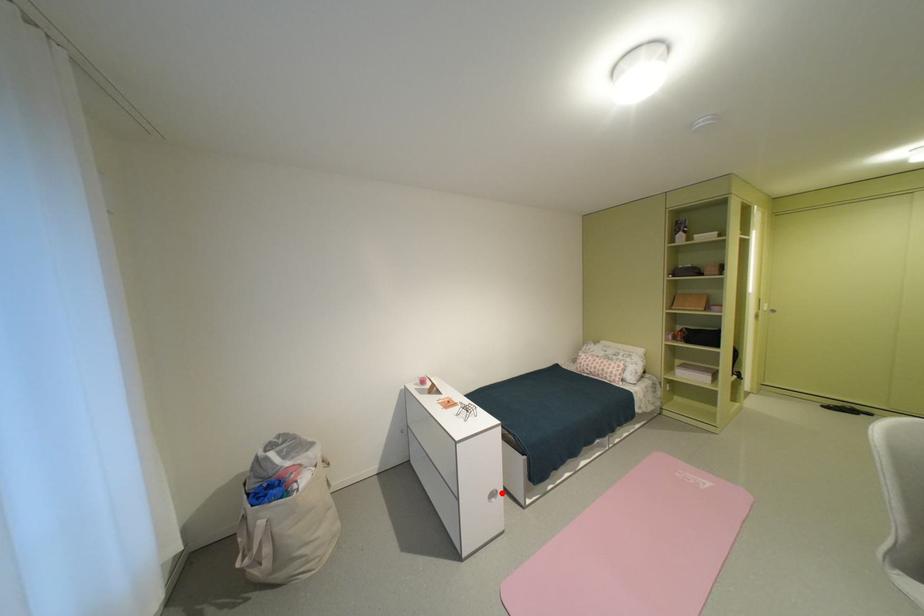
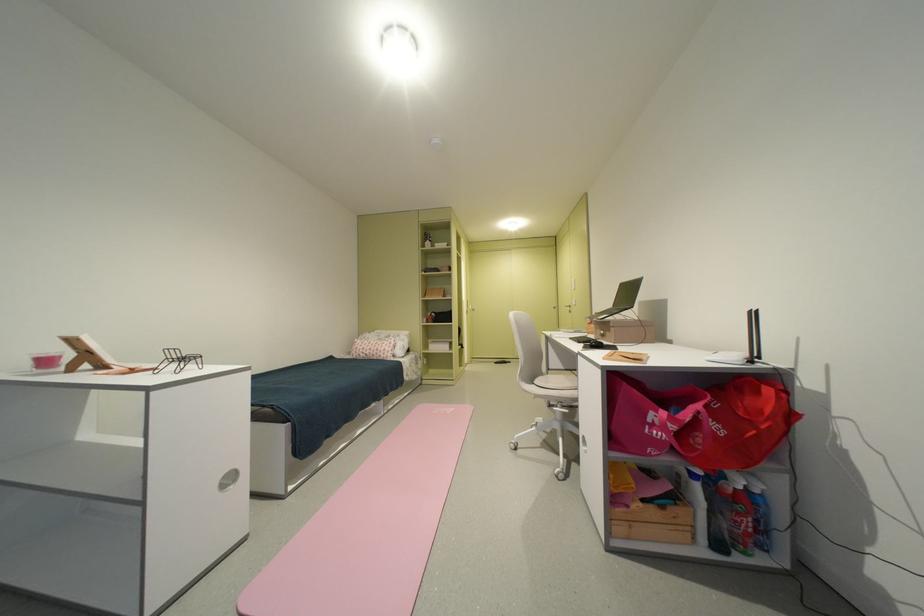
Question: I am providing you with two images of the same scene from different viewpoints. A red point is shown in image1. For the corresponding object point in image2, is it positioned nearer or farther from the camera?

Choices:
 (A) Nearer
 (B) Farther

Answer: (A)